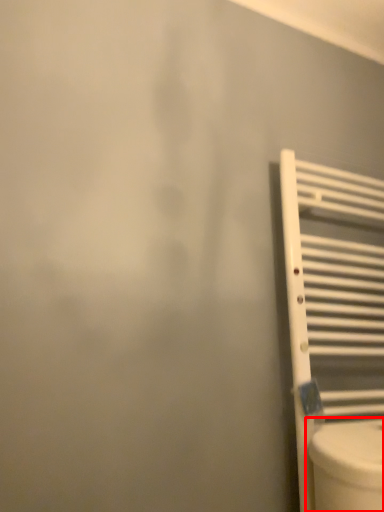
Question: From the image's perspective, where is toilet (annotated by the red box) located in relation to radiator in the image?

Choices:
 (A) above
 (B) below

Answer: (B)